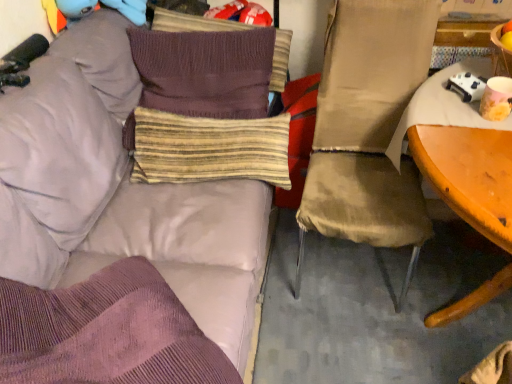
Image resolution: width=512 pixels, height=384 pixels. Describe the element at coordinates (191, 22) in the screenshot. I see `knitted brown pillow at upper center, placed as the 4th pillow when sorted from bottom to top` at that location.

Where is `knitted brown pillow at center, which ranks as the 3th pillow in bottom-to-top order`? This screenshot has height=384, width=512. knitted brown pillow at center, which ranks as the 3th pillow in bottom-to-top order is located at coordinates (205, 71).

Locate an element on the screen. The height and width of the screenshot is (384, 512). matte beige chair at right is located at coordinates point(368,128).

From the image's perspective, which is above, knitted brown pillow at center, which ranks as the 3th pillow in bottom-to-top order, or matte beige chair at right?

knitted brown pillow at center, which ranks as the 3th pillow in bottom-to-top order, from the image's perspective.

Which is more to the left, knitted brown pillow at center, the 2th pillow from the top, or matte beige chair at right?

From the viewer's perspective, knitted brown pillow at center, the 2th pillow from the top, appears more on the left side.

Looking at this image, which object is more forward, knitted brown pillow at center, the 2th pillow from the top, or matte beige chair at right?

matte beige chair at right is closer to the camera.

Is matte yellow cup at right situated inside knitted brown pillow at center, the 2th pillow from the top, or outside?

matte yellow cup at right lies outside knitted brown pillow at center, the 2th pillow from the top.

From a real-world perspective, is matte yellow cup at right physically below knitted brown pillow at center, which ranks as the 3th pillow in bottom-to-top order?

No, from a real-world perspective, matte yellow cup at right is not beneath knitted brown pillow at center, which ranks as the 3th pillow in bottom-to-top order.

In the image, is matte yellow cup at right positioned in front of or behind knitted brown pillow at center, the 2th pillow from the top?

Visually, matte yellow cup at right is located in front of knitted brown pillow at center, the 2th pillow from the top.

Does matte yellow cup at right have a greater height compared to knitted brown pillow at center, the 2th pillow from the top?

In fact, matte yellow cup at right may be shorter than knitted brown pillow at center, the 2th pillow from the top.

Considering the sizes of knitted brown pillow at upper center, placed as the 4th pillow when sorted from bottom to top, and matte purple couch at upper left in the image, is knitted brown pillow at upper center, placed as the 4th pillow when sorted from bottom to top, bigger or smaller than matte purple couch at upper left?

In the image, knitted brown pillow at upper center, placed as the 4th pillow when sorted from bottom to top, appears to be smaller than matte purple couch at upper left.

In the scene shown: From a real-world perspective, who is located lower, knitted brown pillow at upper center, placed as the 4th pillow when sorted from bottom to top, or matte purple couch at upper left?

matte purple couch at upper left.

How many degrees apart are the facing directions of knitted brown pillow at upper center, placed as the 4th pillow when sorted from bottom to top, and matte purple couch at upper left?

83.2 degrees.

At what (x,y) coordinates should I click in order to perform the action: click on studio couch in front of the knitted brown pillow at upper center, the 1th pillow when ordered from top to bottom. Please return your answer as a coordinate pair (x, y). The height and width of the screenshot is (384, 512). Looking at the image, I should click on (122, 213).

Which object is wider, matte purple couch at upper left or knitted brown pillow at upper center, placed as the 4th pillow when sorted from bottom to top?

With larger width is matte purple couch at upper left.

Where is `studio couch that is under the knitted brown pillow at upper center, placed as the 4th pillow when sorted from bottom to top (from a real-world perspective)`? The image size is (512, 384). studio couch that is under the knitted brown pillow at upper center, placed as the 4th pillow when sorted from bottom to top (from a real-world perspective) is located at coordinates (122, 213).

Between matte purple couch at upper left and knitted brown pillow at upper center, the 1th pillow when ordered from top to bottom, which one is positioned in front?

Positioned in front is matte purple couch at upper left.

Can you confirm if knitted brown pillow at upper center, the 1th pillow when ordered from top to bottom, is bigger than matte yellow cup at right?

Yes, knitted brown pillow at upper center, the 1th pillow when ordered from top to bottom, is bigger than matte yellow cup at right.

Consider the image. Considering the sizes of knitted brown pillow at upper center, placed as the 4th pillow when sorted from bottom to top, and matte yellow cup at right in the image, is knitted brown pillow at upper center, placed as the 4th pillow when sorted from bottom to top, wider or thinner than matte yellow cup at right?

Clearly, knitted brown pillow at upper center, placed as the 4th pillow when sorted from bottom to top, has more width compared to matte yellow cup at right.

Is knitted brown pillow at upper center, placed as the 4th pillow when sorted from bottom to top, not near matte yellow cup at right?

knitted brown pillow at upper center, placed as the 4th pillow when sorted from bottom to top, is far away from matte yellow cup at right.

Between knitted brown pillow at upper center, placed as the 4th pillow when sorted from bottom to top, and matte yellow cup at right, which one appears on the right side from the viewer's perspective?

matte yellow cup at right is more to the right.

Choose the correct answer: Is matte beige chair at right inside matte yellow cup at right or outside it?

matte beige chair at right is spatially situated outside matte yellow cup at right.

Is matte beige chair at right with matte yellow cup at right?

No, matte beige chair at right is not in contact with matte yellow cup at right.

Is matte beige chair at right facing away from matte yellow cup at right?

No, matte beige chair at right is not facing away from matte yellow cup at right.

From a real-world perspective, who is located higher, matte beige chair at right or matte yellow cup at right?

matte yellow cup at right, from a real-world perspective.

Can you tell me how much matte purple couch at upper left and matte yellow cup at right differ in facing direction?

The angular difference between matte purple couch at upper left and matte yellow cup at right is 94.8 degrees.

Is matte purple couch at upper left at the left side of matte yellow cup at right?

Yes.

At what (x,y) coordinates should I click in order to perform the action: click on coffee cup located above the matte purple couch at upper left (from the image's perspective). Please return your answer as a coordinate pair (x, y). Looking at the image, I should click on (496, 99).

There is a matte beige chair at right. Where is `the 3rd pillow above it (from the image's perspective)`? This screenshot has width=512, height=384. the 3rd pillow above it (from the image's perspective) is located at coordinates (205, 71).

Where is `coffee cup that appears on the right of knitted brown pillow at center, the 2th pillow from the top`? The height and width of the screenshot is (384, 512). coffee cup that appears on the right of knitted brown pillow at center, the 2th pillow from the top is located at coordinates (496, 99).

Based on their spatial positions, is matte yellow cup at right or matte purple couch at upper left closer to knitted brown pillow at upper center, placed as the 4th pillow when sorted from bottom to top?

matte purple couch at upper left lies closer to knitted brown pillow at upper center, placed as the 4th pillow when sorted from bottom to top, than the other object.

Estimate the real-world distances between objects in this image. Which object is closer to striped fabric pillow at center, the fourth pillow when ordered from top to bottom, matte yellow cup at right or matte beige chair at right?

matte beige chair at right.

Which object lies nearer to the anchor point knitted brown pillow at center, the 2th pillow from the top, striped fabric pillow at center, the second pillow when ordered from bottom to top, or matte beige chair at right?

striped fabric pillow at center, the second pillow when ordered from bottom to top, lies closer to knitted brown pillow at center, the 2th pillow from the top, than the other object.

Estimate the real-world distances between objects in this image. Which object is closer to matte yellow cup at right, striped fabric pillow at center, the second pillow when ordered from bottom to top, or matte beige chair at right?

The object closer to matte yellow cup at right is matte beige chair at right.

Considering their positions, is matte beige chair at right positioned closer to knitted brown pillow at center, the 2th pillow from the top, than striped fabric pillow at center, the third pillow from the top?

striped fabric pillow at center, the third pillow from the top, is closer to knitted brown pillow at center, the 2th pillow from the top.

Consider the image. Considering their positions, is knitted brown pillow at upper center, the 1th pillow when ordered from top to bottom, positioned closer to matte purple couch at upper left than knitted brown pillow at center, the 2th pillow from the top?

The object closer to matte purple couch at upper left is knitted brown pillow at center, the 2th pillow from the top.

Based on their spatial positions, is knitted brown pillow at center, which ranks as the 3th pillow in bottom-to-top order, or matte beige chair at right further from knitted brown pillow at upper center, placed as the 4th pillow when sorted from bottom to top?

matte beige chair at right.

From the image, which object appears to be farther from matte purple couch at upper left, knitted brown pillow at center, the 2th pillow from the top, or matte yellow cup at right?

matte yellow cup at right.

Locate an element on the screen. The image size is (512, 384). chair positioned between matte purple couch at upper left and striped fabric pillow at center, the fourth pillow when ordered from top to bottom, from near to far is located at coordinates (368, 128).

Find the location of a particular element. The width and height of the screenshot is (512, 384). coffee cup between matte purple couch at upper left and knitted brown pillow at upper center, the 1th pillow when ordered from top to bottom, along the z-axis is located at coordinates click(x=496, y=99).

Find the location of `pillow positioned between matte purple couch at upper left and knitted brown pillow at center, the 2th pillow from the top, from near to far`. pillow positioned between matte purple couch at upper left and knitted brown pillow at center, the 2th pillow from the top, from near to far is located at coordinates click(x=210, y=148).

Identify the location of chair situated between striped fabric pillow at center, the first pillow when ordered from bottom to top, and matte yellow cup at right from left to right. The height and width of the screenshot is (384, 512). (368, 128).